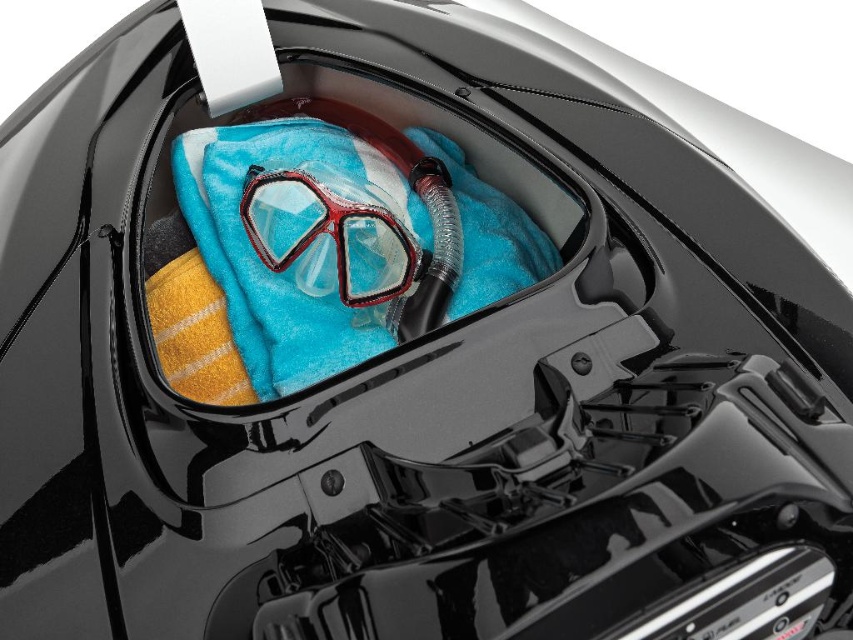
Based on the photo, you are packing for a beach trip and need to place a sunscreen bottle between the blue towel at center and the clear plastic goggles at center in the car trunk. The sunscreen bottle is 5 centimeters long. Will it fit between them without overlapping?

The blue towel at center is 4.80 centimeters away from the clear plastic goggles at center. Since the sunscreen bottle is 5 centimeters long, it will not fit between them without overlapping.

You need to place a rectangular box that is 15 cm wide into the trunk. The box must be placed on either the blue towel at center or the clear plastic goggles at center. Based on their widths, which surface can accommodate the box?

The blue towel at center might be wider than clear plastic goggles at center, so the blue towel at center is more likely to accommodate the 15 cm wide box.